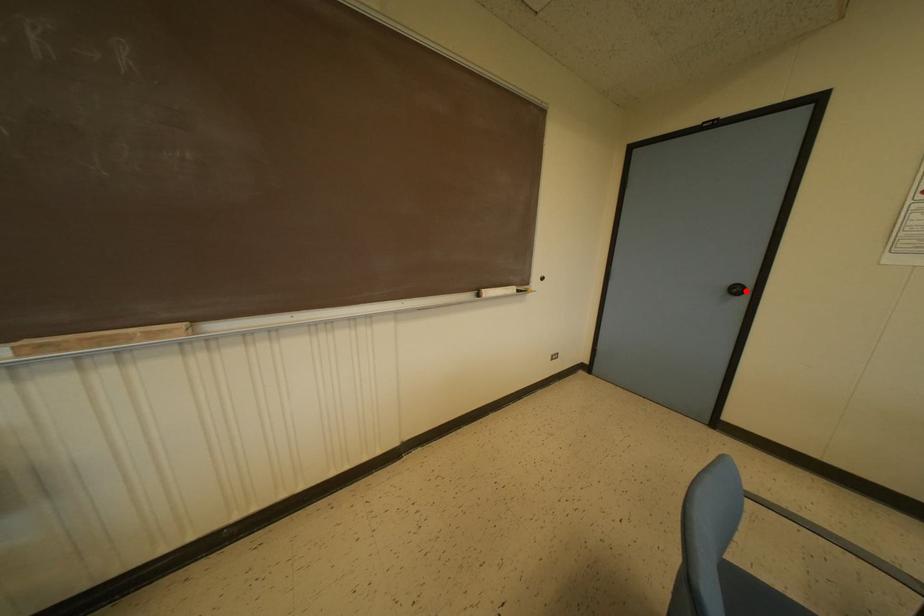
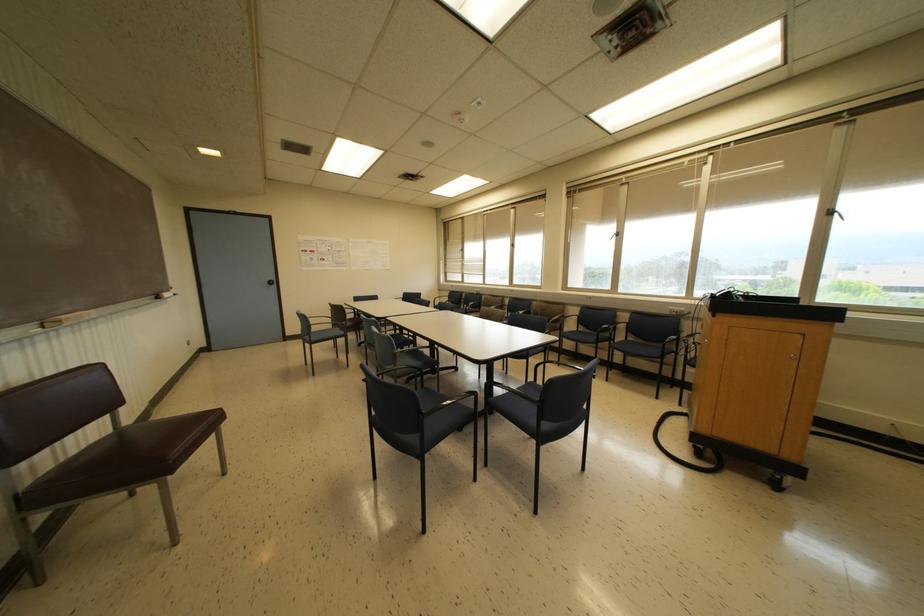
Question: I am providing you with two images of the same scene from different viewpoints. Given a red point in image1, look at the same physical point in image2. Is it:

Choices:
 (A) Closer to the viewpoint
 (B) Farther from the viewpoint

Answer: (B)